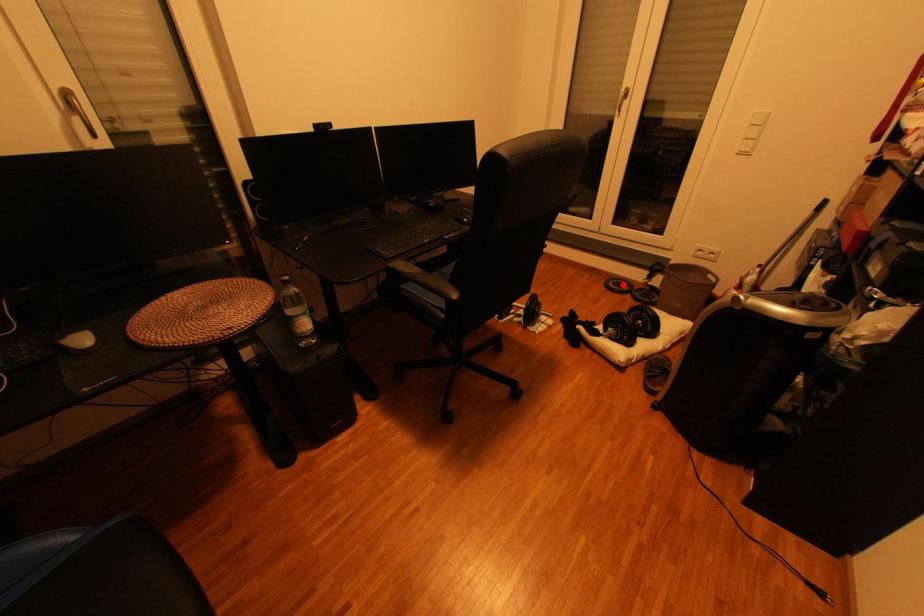
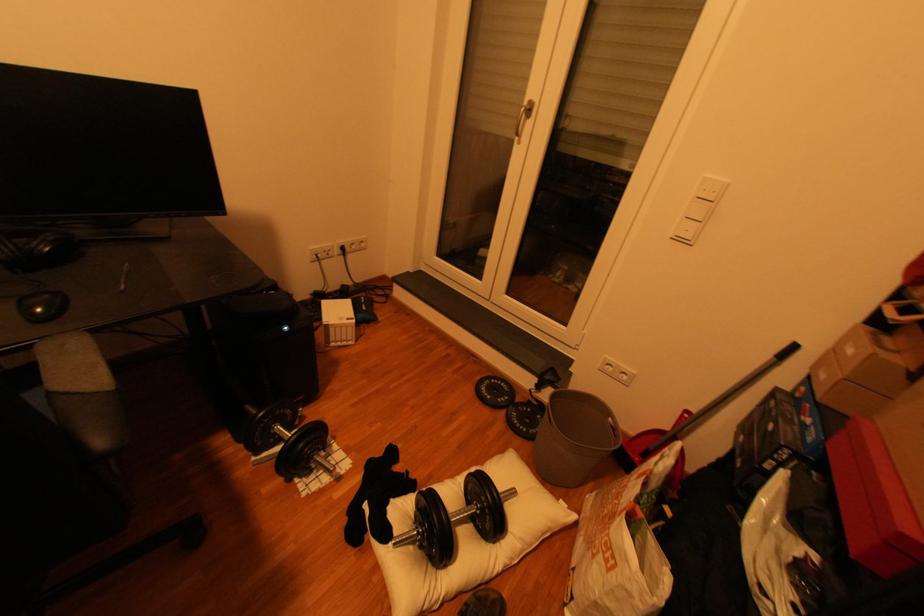
Question: I am providing you with two images of the same scene from different viewpoints. Image1 has a red point marked. In image2, the corresponding 3D location appears at what relative position? Reply with the corresponding letter.

Choices:
 (A) Closer
 (B) Farther

Answer: (B)